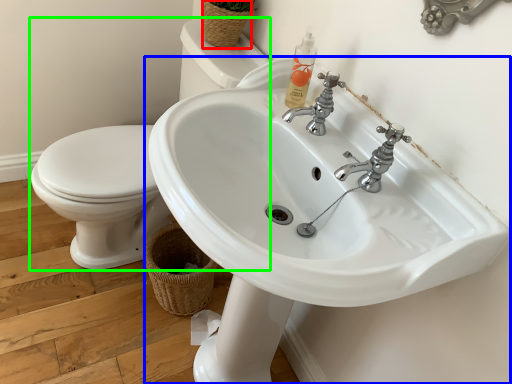
Question: Which is farther away from basket (highlighted by a red box)? sink (highlighted by a blue box) or sink (highlighted by a green box)?

Choices:
 (A) sink
 (B) sink

Answer: (A)